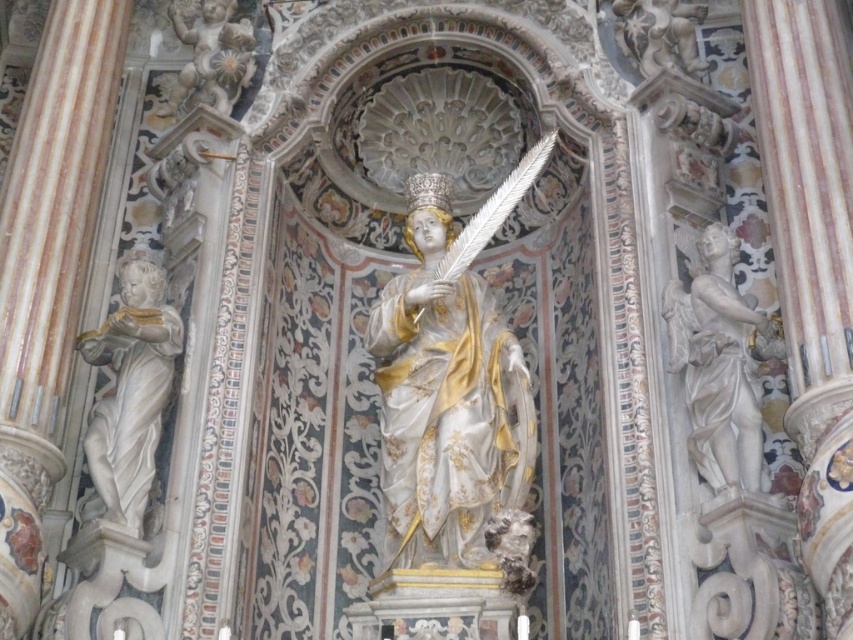
Between point (119, 317) and point (204, 4), which one is positioned in front?

Point (119, 317)

Does white marble statue at left have a lesser height compared to polished marble cherub at upper left?

In fact, white marble statue at left may be taller than polished marble cherub at upper left.

Who is more forward, (154, 465) or (225, 54)?

Point (154, 465)

You are a GUI agent. You are given a task and a screenshot of the screen. Output one action in this format:
    pyautogui.click(x=<x>, y=<y>)
    Task: Click on the white marble statue at left
    The image size is (853, 640).
    Given the screenshot: What is the action you would take?
    pyautogui.click(x=129, y=394)

Who is lower down, polished gold statue at center or white marble statue at left?

Positioned lower is white marble statue at left.

Between polished gold statue at center and white marble statue at left, which one appears on the right side from the viewer's perspective?

polished gold statue at center

Who is more forward, (450, 422) or (154, 445)?

Point (154, 445)

This screenshot has height=640, width=853. I want to click on polished gold statue at center, so click(x=451, y=384).

Does polished gold statue at center have a greater width compared to polished marble cherub at upper left?

Yes, polished gold statue at center is wider than polished marble cherub at upper left.

Where is `polished gold statue at center`? The width and height of the screenshot is (853, 640). polished gold statue at center is located at coordinates (451, 384).

Is point (450, 196) closer to camera compared to point (190, 108)?

Yes, it is.

Identify the location of polished gold statue at center. pyautogui.click(x=451, y=384).